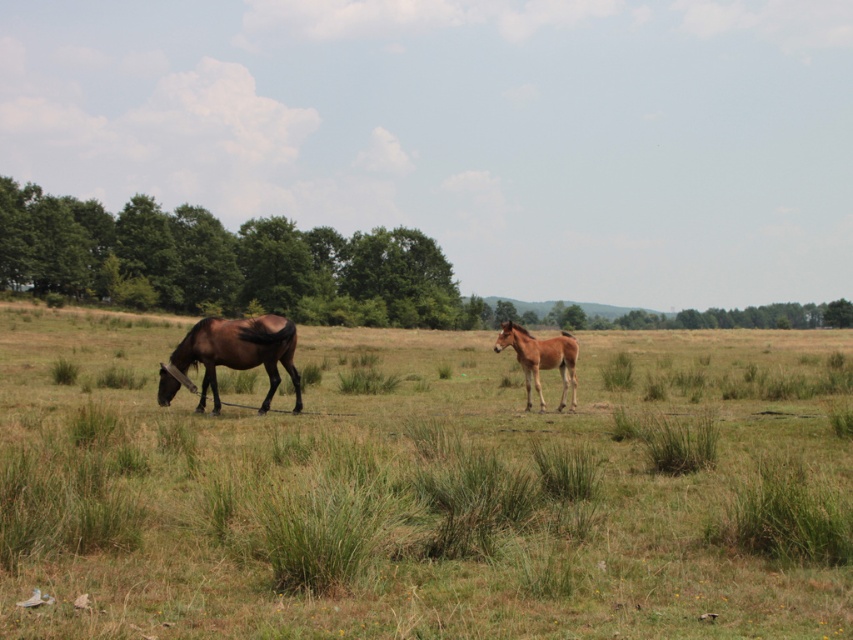
You are a farmer checking the field. You see the brown grassland at center and the brown glossy horse at center. Which one covers a bigger area in the image?

The brown grassland at center is larger in size than the brown glossy horse at center, so the brown grassland at center covers a bigger area in the image.